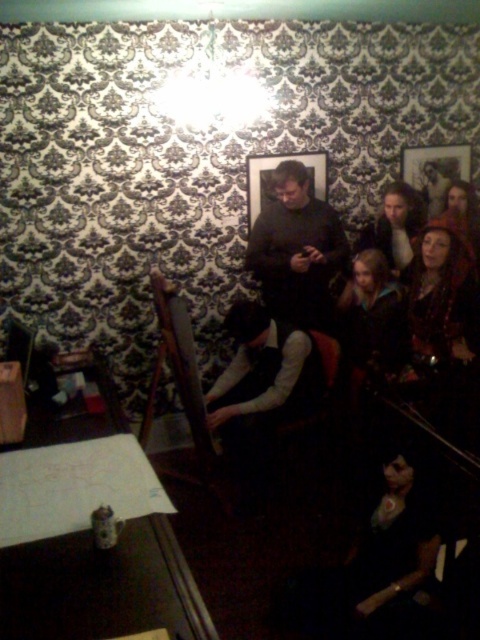
Looking at this image, between wooden picture frame at upper right and wooden picture frame at upper center, which one appears on the left side from the viewer's perspective?

wooden picture frame at upper center

Can you confirm if wooden picture frame at upper right is positioned above wooden picture frame at upper center?

Yes, wooden picture frame at upper right is above wooden picture frame at upper center.

Find the location of a particular element. The width and height of the screenshot is (480, 640). wooden picture frame at upper right is located at coordinates (434, 172).

Between dark gray sweater at center and wooden picture frame at upper center, which one has more height?

With more height is dark gray sweater at center.

Does dark gray sweater at center come in front of wooden picture frame at upper center?

Yes, dark gray sweater at center is in front of wooden picture frame at upper center.

Identify the location of dark gray sweater at center. The width and height of the screenshot is (480, 640). (297, 250).

Which of these two, dark gray sweater at center or wooden picture frame at upper right, stands taller?

dark gray sweater at center is taller.

Is point (288, 163) less distant than point (432, 202)?

Yes, point (288, 163) is closer to viewer.

You are a GUI agent. You are given a task and a screenshot of the screen. Output one action in this format:
    pyautogui.click(x=<x>, y=<y>)
    Task: Click on the dark gray sweater at center
    The image size is (480, 640).
    Given the screenshot: What is the action you would take?
    pyautogui.click(x=297, y=250)